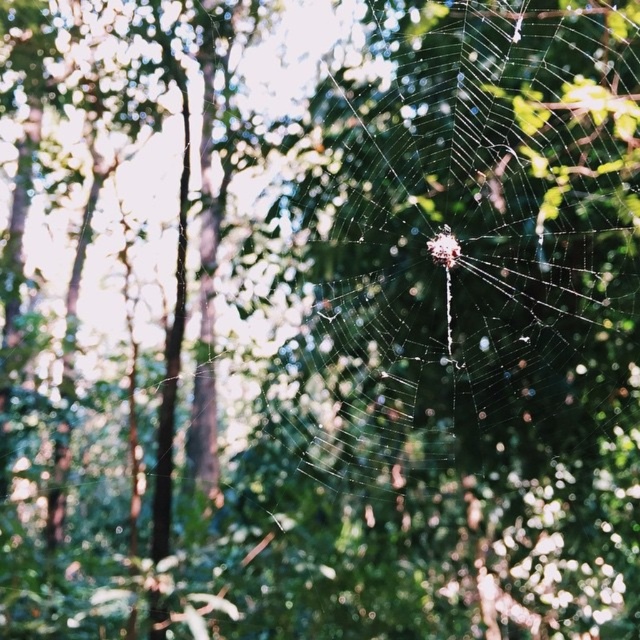
Question: Which point is farther to the camera?

Choices:
 (A) translucent silk spider at center
 (B) transparent silk spider web at center

Answer: (A)

Question: Which object is closer to the camera taking this photo?

Choices:
 (A) transparent silk spider web at center
 (B) translucent silk spider at center

Answer: (A)

Question: Is transparent silk spider web at center smaller than translucent silk spider at center?

Choices:
 (A) no
 (B) yes

Answer: (A)

Question: Is transparent silk spider web at center to the left of translucent silk spider at center from the viewer's perspective?

Choices:
 (A) no
 (B) yes

Answer: (B)

Question: Does transparent silk spider web at center have a smaller size compared to translucent silk spider at center?

Choices:
 (A) no
 (B) yes

Answer: (A)